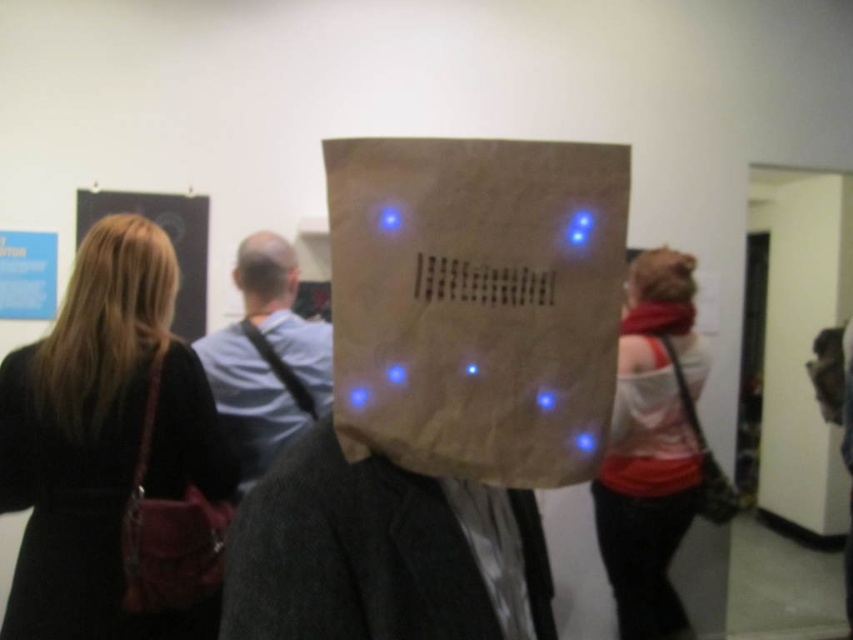
Question: Can you confirm if matte white shirt at right is positioned to the left of brown paper bag at right?

Choices:
 (A) no
 (B) yes

Answer: (B)

Question: Which point appears closest to the camera in this image?

Choices:
 (A) (714, 464)
 (B) (291, 253)

Answer: (B)

Question: Which of the following is the farthest from the observer?

Choices:
 (A) (730, 481)
 (B) (688, 314)

Answer: (A)

Question: Can you confirm if leather-like red handbag at left is smaller than blonde hair at left?

Choices:
 (A) no
 (B) yes

Answer: (A)

Question: Which of the following is the closest to the observer?

Choices:
 (A) 611,195
 (B) 247,275
 (C) 146,257
 (D) 689,264

Answer: (A)

Question: Can you confirm if black leather coat at left is positioned to the right of brown paper bag at right?

Choices:
 (A) no
 (B) yes

Answer: (A)